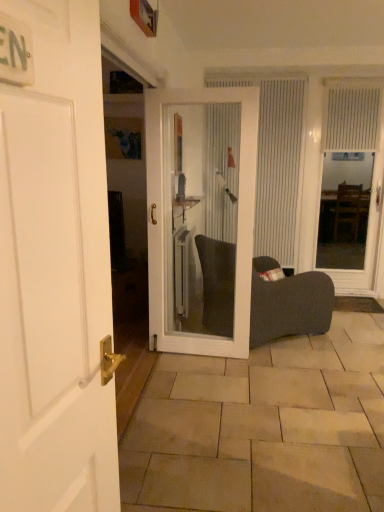
Question: Is transparent glass door at right surrounding white textured curtain at upper right, the 1th curtain viewed from the right?

Choices:
 (A) no
 (B) yes

Answer: (B)

Question: Does transparent glass door at right have a lesser width compared to white textured curtain at upper right, the 1th curtain viewed from the right?

Choices:
 (A) yes
 (B) no

Answer: (B)

Question: Can you confirm if transparent glass door at right is smaller than white textured curtain at upper right, which is the 2th curtain from left to right?

Choices:
 (A) no
 (B) yes

Answer: (A)

Question: Does transparent glass door at right turn towards white textured curtain at upper right, which is the 2th curtain from left to right?

Choices:
 (A) no
 (B) yes

Answer: (B)

Question: From a real-world perspective, does transparent glass door at right stand above white textured curtain at upper right, which is the 2th curtain from left to right?

Choices:
 (A) yes
 (B) no

Answer: (B)

Question: From the image's perspective, would you say transparent glass door at right is shown under white textured curtain at upper right, which is the 2th curtain from left to right?

Choices:
 (A) no
 (B) yes

Answer: (B)

Question: Is white matte door at left, the second door positioned from the back, positioned far away from transparent glass door at right?

Choices:
 (A) yes
 (B) no

Answer: (A)

Question: Is white matte door at left, the second door positioned from the back, located outside transparent glass door at right?

Choices:
 (A) no
 (B) yes

Answer: (B)

Question: Could you tell me if white matte door at left, the second door positioned from the back, is turned towards transparent glass door at right?

Choices:
 (A) no
 (B) yes

Answer: (A)

Question: Is white matte door at left, the second door positioned from the back, to the right of transparent glass door at right from the viewer's perspective?

Choices:
 (A) yes
 (B) no

Answer: (B)

Question: From the image's perspective, is white matte door at left, the second door positioned from the back, on top of transparent glass door at right?

Choices:
 (A) no
 (B) yes

Answer: (A)

Question: Considering the relative sizes of white matte door at left, the second door positioned from the back, and transparent glass door at right in the image provided, is white matte door at left, the second door positioned from the back, taller than transparent glass door at right?

Choices:
 (A) no
 (B) yes

Answer: (A)

Question: Is white matte door at left, which is counted as the 1th door, starting from the front, taller than white textured curtain at upper right, the 1th curtain viewed from the right?

Choices:
 (A) yes
 (B) no

Answer: (A)